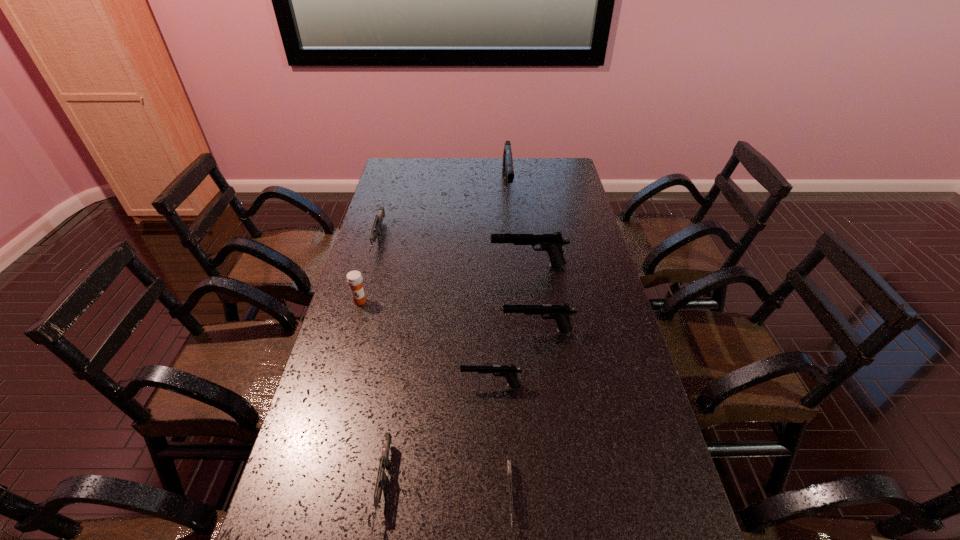
You are a GUI agent. You are given a task and a screenshot of the screen. Output one action in this format:
    pyautogui.click(x=<x>, y=<y>)
    Task: Click on the farthest object
    The height and width of the screenshot is (540, 960).
    Given the screenshot: What is the action you would take?
    pyautogui.click(x=507, y=169)

I want to click on the tallest object, so click(x=507, y=169).

I want to click on the third nearest black gun, so click(551, 242).

Locate an element on the screen. The height and width of the screenshot is (540, 960). the second tallest gun is located at coordinates [x=551, y=242].

I want to click on the third tallest gun, so click(560, 313).

Locate an element on the screen. Image resolution: width=960 pixels, height=540 pixels. the fourth nearest object is located at coordinates (560, 313).

Where is `the fifth nearest object`? the fifth nearest object is located at coordinates (354, 278).

Identify the location of the smallest black gun. (510, 372).

Where is `the nearest black gun`? the nearest black gun is located at coordinates (510, 372).

The image size is (960, 540). What are the coordinates of `the leftmost gun` in the screenshot? It's located at (377, 225).